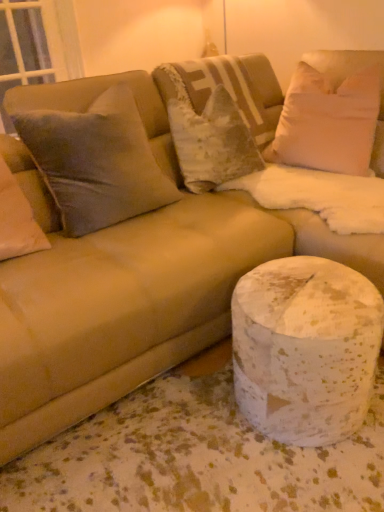
Question: In which direction should I rotate to look at velvet textured pillow at center, acting as the 4th pillow starting from the left?

Choices:
 (A) right
 (B) left

Answer: (A)

Question: From the image's perspective, is velvet gray pillow at upper left, acting as the 2th pillow starting from the left, on transparent glass window screen at upper left?

Choices:
 (A) yes
 (B) no

Answer: (B)

Question: Is velvet gray pillow at upper left, which ranks as the 4th pillow in right-to-left order, placed right next to transparent glass window screen at upper left?

Choices:
 (A) no
 (B) yes

Answer: (A)

Question: Considering the relative positions of velvet gray pillow at upper left, acting as the 2th pillow starting from the left, and transparent glass window screen at upper left in the image provided, is velvet gray pillow at upper left, acting as the 2th pillow starting from the left, to the left of transparent glass window screen at upper left from the viewer's perspective?

Choices:
 (A) yes
 (B) no

Answer: (B)

Question: Can you confirm if velvet gray pillow at upper left, acting as the 2th pillow starting from the left, is shorter than transparent glass window screen at upper left?

Choices:
 (A) yes
 (B) no

Answer: (A)

Question: Considering the relative positions of velvet gray pillow at upper left, which ranks as the 4th pillow in right-to-left order, and transparent glass window screen at upper left in the image provided, is velvet gray pillow at upper left, which ranks as the 4th pillow in right-to-left order, behind transparent glass window screen at upper left?

Choices:
 (A) no
 (B) yes

Answer: (A)

Question: From the image's perspective, is velvet gray pillow at upper left, acting as the 2th pillow starting from the left, below transparent glass window screen at upper left?

Choices:
 (A) no
 (B) yes

Answer: (B)

Question: From the image's perspective, is velvet beige pillow at center, the 3th pillow in the left-to-right sequence, under white speckled marble at lower right?

Choices:
 (A) no
 (B) yes

Answer: (A)

Question: Is velvet beige pillow at center, the 3th pillow in the left-to-right sequence, wider than white speckled marble at lower right?

Choices:
 (A) yes
 (B) no

Answer: (A)

Question: Does velvet beige pillow at center, the 3th pillow in the left-to-right sequence, lie in front of white speckled marble at lower right?

Choices:
 (A) yes
 (B) no

Answer: (B)

Question: Is white speckled marble at lower right at the back of velvet beige pillow at center, the 3th pillow in the left-to-right sequence?

Choices:
 (A) no
 (B) yes

Answer: (A)

Question: Does velvet beige pillow at center, placed as the third pillow when sorted from right to left, have a larger size compared to white speckled marble at lower right?

Choices:
 (A) no
 (B) yes

Answer: (B)

Question: From a real-world perspective, is velvet beige pillow at center, placed as the third pillow when sorted from right to left, on white speckled marble at lower right?

Choices:
 (A) no
 (B) yes

Answer: (B)

Question: Is white soft pillow at upper right, the 5th pillow in the left-to-right sequence, closer to camera compared to white speckled marble at lower right?

Choices:
 (A) yes
 (B) no

Answer: (B)